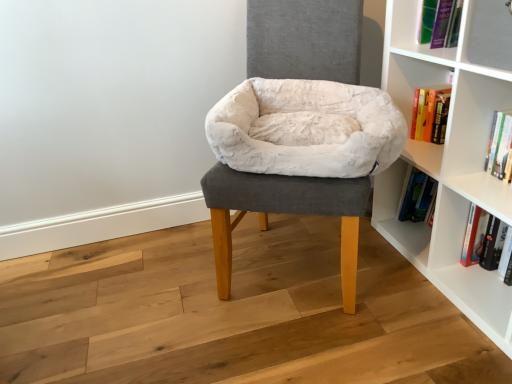
Question: From their relative heights in the image, would you say white plush pet bed at center is taller or shorter than white plush bean bag at center?

Choices:
 (A) tall
 (B) short

Answer: (A)

Question: Considering the positions of white plush pet bed at center and white plush bean bag at center in the image, is white plush pet bed at center wider or thinner than white plush bean bag at center?

Choices:
 (A) thin
 (B) wide

Answer: (B)

Question: Estimate the real-world distances between objects in this image. Which object is farther from the white plush pet bed at center?

Choices:
 (A) white plush bean bag at center
 (B) white glossy bookshelf at upper right
 (C) hardcover book at lower right, which is the first book in bottom-to-top order
 (D) hardcover book at upper right, the 2th book ordered from the bottom

Answer: (C)

Question: Considering the real-world distances, which object is closest to the hardcover book at upper right, the 2th book ordered from the bottom?

Choices:
 (A) white plush bean bag at center
 (B) hardcover book at lower right, which is counted as the 2th book, starting from the top
 (C) white plush pet bed at center
 (D) white glossy bookshelf at upper right

Answer: (B)